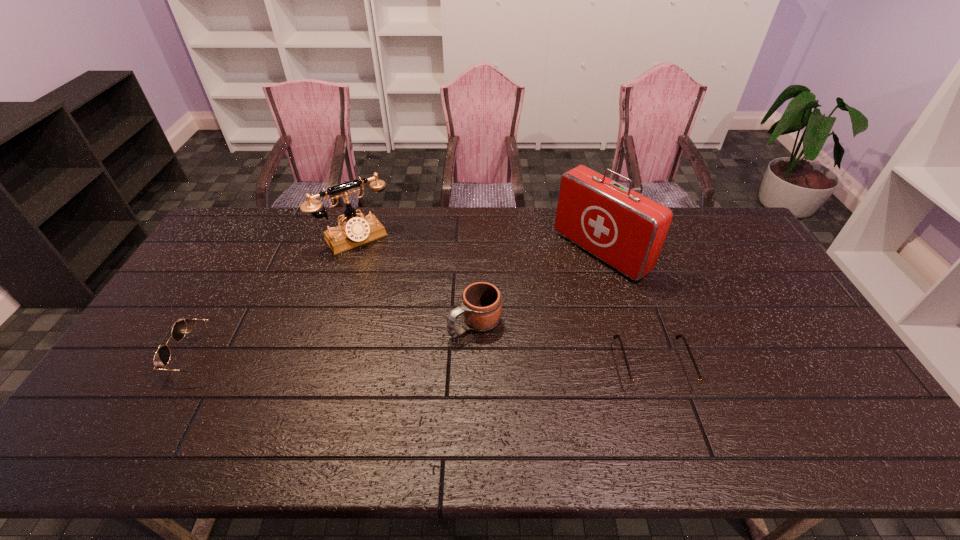
At what (x,y) coordinates should I click in order to perform the action: click on vacant spot on the desktop that is between the leftmost object and the spectacles and is positioned on the side of the first-aid kit with the first aid cross symbol. Please return your answer as a coordinate pair (x, y). The image size is (960, 540). Looking at the image, I should click on (438, 361).

Locate an element on the screen. free spot on the desktop that is between the leftmost object and the spectacles and is positioned on the side of the mug with the handle is located at coordinates (418, 361).

You are a GUI agent. You are given a task and a screenshot of the screen. Output one action in this format:
    pyautogui.click(x=<x>, y=<y>)
    Task: Click on the free spot on the desktop that is between the second shortest object and the spectacles and is positioned on the dial of the second tallest object
    This screenshot has width=960, height=540.
    Given the screenshot: What is the action you would take?
    pyautogui.click(x=444, y=361)